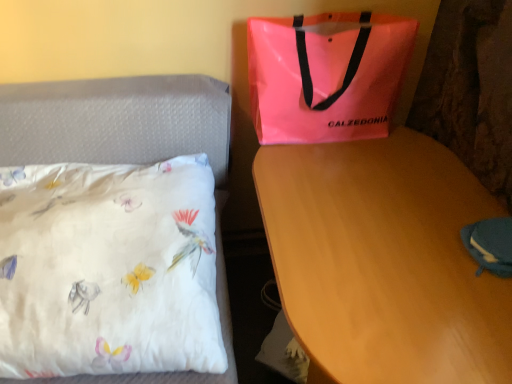
Locate an element on the screen. The image size is (512, 384). neon pink plastic bag at upper right is located at coordinates (326, 75).

You are a GUI agent. You are given a task and a screenshot of the screen. Output one action in this format:
    pyautogui.click(x=<x>, y=<y>)
    Task: Click on the wooden desk at center
    The height and width of the screenshot is (384, 512).
    Given the screenshot: What is the action you would take?
    pyautogui.click(x=384, y=261)

Image resolution: width=512 pixels, height=384 pixels. What do you see at coordinates (384, 261) in the screenshot?
I see `wooden desk at center` at bounding box center [384, 261].

Where is `neon pink plastic bag at upper right`? neon pink plastic bag at upper right is located at coordinates (326, 75).

Measure the distance from neon pink plastic bag at upper right to blue fabric pouch at lower right.

They are 22.60 inches apart.

From the image's perspective, between neon pink plastic bag at upper right and blue fabric pouch at lower right, who is located below?

blue fabric pouch at lower right appears lower in the image.

Is neon pink plastic bag at upper right not near blue fabric pouch at lower right?

They are positioned close to each other.

From the image's perspective, is wooden desk at center located above or below white satin pillow at left?

From the image's perspective, wooden desk at center appears below white satin pillow at left.

Would you say wooden desk at center is outside white satin pillow at left?

wooden desk at center is positioned outside white satin pillow at left.

This screenshot has height=384, width=512. Find the location of `desk below the white satin pillow at left (from the image's perspective)`. desk below the white satin pillow at left (from the image's perspective) is located at coordinates (384, 261).

Does wooden desk at center touch white satin pillow at left?

No, wooden desk at center is not in contact with white satin pillow at left.

From the image's perspective, who appears lower, wooden desk at center or blue fabric pouch at lower right?

wooden desk at center appears lower in the image.

Considering the sizes of wooden desk at center and blue fabric pouch at lower right in the image, is wooden desk at center wider or thinner than blue fabric pouch at lower right?

Clearly, wooden desk at center has more width compared to blue fabric pouch at lower right.

Is the position of wooden desk at center less distant than that of blue fabric pouch at lower right?

Yes.

From their relative heights in the image, would you say wooden desk at center is taller or shorter than blue fabric pouch at lower right?

Clearly, wooden desk at center is taller compared to blue fabric pouch at lower right.

Is neon pink plastic bag at upper right smaller than white satin pillow at left?

Yes, neon pink plastic bag at upper right is smaller than white satin pillow at left.

Measure the distance between neon pink plastic bag at upper right and white satin pillow at left.

neon pink plastic bag at upper right and white satin pillow at left are 13.09 inches apart from each other.

From the image's perspective, which object appears higher, neon pink plastic bag at upper right or white satin pillow at left?

neon pink plastic bag at upper right.

Is there a large distance between neon pink plastic bag at upper right and white satin pillow at left?

No, neon pink plastic bag at upper right is not far from white satin pillow at left.

Is white satin pillow at left facing away from neon pink plastic bag at upper right?

That's not correct — white satin pillow at left is not looking away from neon pink plastic bag at upper right.

Does white satin pillow at left have a greater height compared to neon pink plastic bag at upper right?

Indeed, white satin pillow at left has a greater height compared to neon pink plastic bag at upper right.

From a real-world perspective, does white satin pillow at left stand above neon pink plastic bag at upper right?

No.

From a real-world perspective, is blue fabric pouch at lower right over wooden desk at center?

Correct, in the physical world, blue fabric pouch at lower right is higher than wooden desk at center.

How many degrees apart are the facing directions of blue fabric pouch at lower right and wooden desk at center?

The angle between the facing direction of blue fabric pouch at lower right and the facing direction of wooden desk at center is 0.683 degrees.

Is wooden desk at center completely or partially inside blue fabric pouch at lower right?

Definitely not — wooden desk at center is not inside blue fabric pouch at lower right.

Locate an element on the screen. The width and height of the screenshot is (512, 384). pouch above the wooden desk at center (from the image's perspective) is located at coordinates (490, 245).

Considering the positions of objects wooden desk at center and neon pink plastic bag at upper right in the image provided, who is more to the left, wooden desk at center or neon pink plastic bag at upper right?

From the viewer's perspective, neon pink plastic bag at upper right appears more on the left side.

Does wooden desk at center have a greater height compared to neon pink plastic bag at upper right?

Yes.

Is wooden desk at center directly adjacent to neon pink plastic bag at upper right?

There is a gap between wooden desk at center and neon pink plastic bag at upper right.

From a real-world perspective, which is physically above, wooden desk at center or neon pink plastic bag at upper right?

From a 3D spatial view, neon pink plastic bag at upper right is above.

Where is `pouch located on the right of neon pink plastic bag at upper right`? This screenshot has height=384, width=512. pouch located on the right of neon pink plastic bag at upper right is located at coordinates (490, 245).

Find the location of a particular element. bed lying above the wooden desk at center (from the image's perspective) is located at coordinates (116, 121).

Looking at the image, which one is located further to white satin pillow at left, blue fabric pouch at lower right or wooden desk at center?

blue fabric pouch at lower right is further to white satin pillow at left.

When comparing their distances from blue fabric pouch at lower right, does neon pink plastic bag at upper right or wooden desk at center seem closer?

wooden desk at center lies closer to blue fabric pouch at lower right than the other object.

Which object lies further to the anchor point white satin pillow at left, neon pink plastic bag at upper right or wooden desk at center?

wooden desk at center is positioned further to the anchor white satin pillow at left.

Which object lies nearer to the anchor point wooden desk at center, neon pink plastic bag at upper right or white satin pillow at left?

Among the two, neon pink plastic bag at upper right is located nearer to wooden desk at center.

Estimate the real-world distances between objects in this image. Which object is closer to blue fabric pouch at lower right, white satin pillow at left or wooden desk at center?

The object closer to blue fabric pouch at lower right is wooden desk at center.

From the image, which object appears to be farther from neon pink plastic bag at upper right, blue fabric pouch at lower right or wooden desk at center?

blue fabric pouch at lower right is further to neon pink plastic bag at upper right.

From the image, which object appears to be farther from neon pink plastic bag at upper right, white satin pillow at left or blue fabric pouch at lower right?

blue fabric pouch at lower right is further to neon pink plastic bag at upper right.

When comparing their distances from neon pink plastic bag at upper right, does white satin pillow at left or wooden desk at center seem closer?

wooden desk at center is positioned closer to the anchor neon pink plastic bag at upper right.

At what (x,y) coordinates should I click in order to perform the action: click on handbag between white satin pillow at left and blue fabric pouch at lower right in the horizontal direction. Please return your answer as a coordinate pair (x, y). The image size is (512, 384). Looking at the image, I should click on (326, 75).

Where is `desk situated between white satin pillow at left and blue fabric pouch at lower right from left to right`? This screenshot has height=384, width=512. desk situated between white satin pillow at left and blue fabric pouch at lower right from left to right is located at coordinates (384, 261).

Locate an element on the screen. The height and width of the screenshot is (384, 512). handbag between white satin pillow at left and wooden desk at center is located at coordinates (326, 75).

In order to click on pouch between neon pink plastic bag at upper right and wooden desk at center in the up-down direction in this screenshot , I will do `click(490, 245)`.